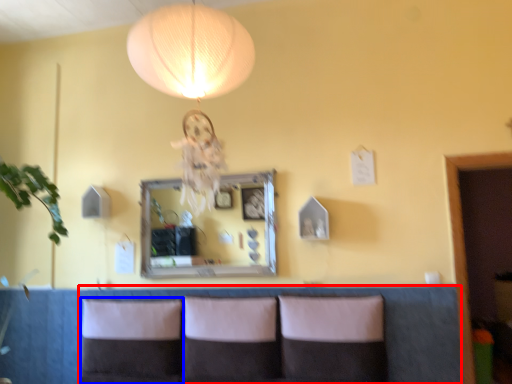
Question: Among these objects, which one is nearest to the camera, couch (highlighted by a red box) or pillow (highlighted by a blue box)?

Choices:
 (A) couch
 (B) pillow

Answer: (A)